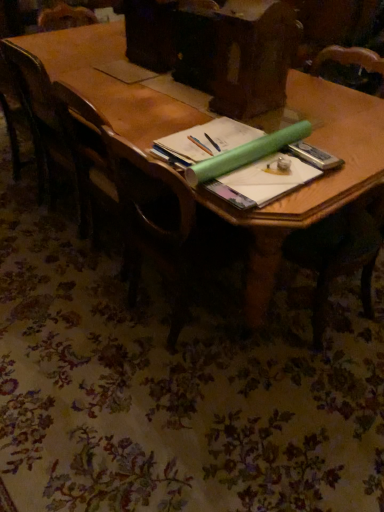
At what (x,y) coordinates should I click in order to perform the action: click on wooden chair at left, positioned as the 2th chair in front-to-back order. Please return your answer as a coordinate pair (x, y). The height and width of the screenshot is (512, 384). Looking at the image, I should click on (x=43, y=123).

What do you see at coordinates (312, 183) in the screenshot?
I see `wooden table at center` at bounding box center [312, 183].

Where is `wooden chair at center, which appears as the first chair when viewed from the front`? The image size is (384, 512). wooden chair at center, which appears as the first chair when viewed from the front is located at coordinates [x=163, y=226].

At what (x,y) coordinates should I click in order to perform the action: click on wooden chair at left, the 2th chair from the right. Please return your answer as a coordinate pair (x, y). This screenshot has height=512, width=384. Looking at the image, I should click on (43, 123).

Which object is closer to the camera taking this photo, wooden table at center or wooden chair at left, the 2th chair from the right?

wooden table at center is closer to the camera.

Are wooden table at center and wooden chair at left, positioned as the 2th chair in front-to-back order, far apart?

No, wooden table at center is in close proximity to wooden chair at left, positioned as the 2th chair in front-to-back order.

Is wooden table at center positioned with its back to wooden chair at left, the first chair in the back-to-front sequence?

wooden table at center does not have its back to wooden chair at left, the first chair in the back-to-front sequence.

Considering the sizes of wooden table at center and wooden chair at left, the 2th chair from the right, in the image, is wooden table at center taller or shorter than wooden chair at left, the 2th chair from the right,?

Considering their sizes, wooden table at center has less height than wooden chair at left, the 2th chair from the right.

From a real-world perspective, between wooden chair at left, the 2th chair from the right, and wooden table at center, who is vertically higher?

In real-world perspective, wooden chair at left, the 2th chair from the right, is above.

Is wooden chair at left, the 2th chair from the right, next to wooden table at center and touching it?

No, wooden chair at left, the 2th chair from the right, is not next to wooden table at center.

Considering the relative sizes of wooden chair at left, positioned as the 2th chair in front-to-back order, and wooden table at center in the image provided, is wooden chair at left, positioned as the 2th chair in front-to-back order, bigger than wooden table at center?

Actually, wooden chair at left, positioned as the 2th chair in front-to-back order, might be smaller than wooden table at center.

Consider the image. How different are the orientations of wooden chair at left, positioned as the first chair in left-to-right order, and wooden chair at center, the 1th chair viewed from the right, in degrees?

They differ by 1.57 degrees in their facing directions.

Considering the points (35, 58) and (124, 267), which point is behind, point (35, 58) or point (124, 267)?

The point (124, 267) is farther from the camera.

Could wooden chair at center, the 1th chair viewed from the right, be considered to be inside wooden chair at left, positioned as the 2th chair in front-to-back order?

Actually, wooden chair at center, the 1th chair viewed from the right, is outside wooden chair at left, positioned as the 2th chair in front-to-back order.

Could you tell me if wooden chair at left, the first chair in the back-to-front sequence, is facing wooden chair at center, which appears as the first chair when viewed from the front?

No, wooden chair at left, the first chair in the back-to-front sequence, is not oriented towards wooden chair at center, which appears as the first chair when viewed from the front.

Is wooden chair at center, the 1th chair viewed from the right, positioned beyond the bounds of wooden chair at left, positioned as the first chair in left-to-right order?

Yes, wooden chair at center, the 1th chair viewed from the right, is located beyond the bounds of wooden chair at left, positioned as the first chair in left-to-right order.

Is point (132, 295) positioned in front of point (37, 62)?

No, it is not.

The image size is (384, 512). In order to click on chair that appears on the right of wooden chair at left, positioned as the first chair in left-to-right order in this screenshot , I will do `click(163, 226)`.

From the image's perspective, is wooden table at center located above or below wooden chair at center, which is the second chair in left-to-right order?

wooden table at center is situated higher than wooden chair at center, which is the second chair in left-to-right order, in the image.

Relative to wooden chair at center, which is the second chair in left-to-right order, is wooden table at center in front or behind?

wooden table at center is positioned closer to the viewer than wooden chair at center, which is the second chair in left-to-right order.

You are a GUI agent. You are given a task and a screenshot of the screen. Output one action in this format:
    pyautogui.click(x=<x>, y=<y>)
    Task: Click on the table in front of the wooden chair at center, the 1th chair viewed from the right
    Image resolution: width=384 pixels, height=512 pixels.
    Given the screenshot: What is the action you would take?
    pyautogui.click(x=312, y=183)

In terms of height, does wooden table at center look taller or shorter compared to wooden chair at center, the 1th chair viewed from the right?

wooden table at center is shorter than wooden chair at center, the 1th chair viewed from the right.

From a real-world perspective, is wooden chair at center, which appears as the second chair when viewed from the back, over wooden table at center?

Yes, from a real-world perspective, wooden chair at center, which appears as the second chair when viewed from the back, is above wooden table at center.

From the image's perspective, is wooden chair at center, which is the second chair in left-to-right order, above or below wooden table at center?

From the image's perspective, wooden chair at center, which is the second chair in left-to-right order, appears below wooden table at center.

Considering the relative positions of wooden chair at center, which appears as the second chair when viewed from the back, and wooden table at center in the image provided, is wooden chair at center, which appears as the second chair when viewed from the back, to the right of wooden table at center from the viewer's perspective?

Yes, wooden chair at center, which appears as the second chair when viewed from the back, is to the right of wooden table at center.

The image size is (384, 512). I want to click on chair above the wooden table at center (from the image's perspective), so click(43, 123).

In the image, there is a wooden chair at left, the first chair in the back-to-front sequence. Find the location of `table below it (from a real-world perspective)`. table below it (from a real-world perspective) is located at coordinates (312, 183).

When comparing their distances from wooden chair at left, positioned as the 2th chair in front-to-back order, does wooden table at center or wooden chair at center, which is the second chair in left-to-right order, seem further?

wooden chair at center, which is the second chair in left-to-right order, is positioned further to the anchor wooden chair at left, positioned as the 2th chair in front-to-back order.

Based on their spatial positions, is wooden chair at center, which appears as the first chair when viewed from the front, or wooden chair at left, the 2th chair from the right, closer to wooden table at center?

wooden chair at left, the 2th chair from the right.

When comparing their distances from wooden chair at left, the first chair in the back-to-front sequence, does wooden chair at center, which appears as the first chair when viewed from the front, or wooden table at center seem closer?

wooden table at center.

From the image, which object appears to be nearer to wooden chair at center, the 1th chair viewed from the right, wooden chair at left, positioned as the 2th chair in front-to-back order, or wooden table at center?

Among the two, wooden table at center is located nearer to wooden chair at center, the 1th chair viewed from the right.

Based on their spatial positions, is wooden chair at left, positioned as the first chair in left-to-right order, or wooden chair at center, which appears as the second chair when viewed from the back, closer to wooden table at center?

The object closer to wooden table at center is wooden chair at left, positioned as the first chair in left-to-right order.

From the image, which object appears to be farther from wooden chair at center, which is the second chair in left-to-right order, wooden table at center or wooden chair at left, positioned as the 2th chair in front-to-back order?

Among the two, wooden chair at left, positioned as the 2th chair in front-to-back order, is located further to wooden chair at center, which is the second chair in left-to-right order.

You are a GUI agent. You are given a task and a screenshot of the screen. Output one action in this format:
    pyautogui.click(x=<x>, y=<y>)
    Task: Click on the table between wooden chair at left, positioned as the first chair in left-to-right order, and wooden chair at center, which appears as the second chair when viewed from the back
    Image resolution: width=384 pixels, height=512 pixels.
    Given the screenshot: What is the action you would take?
    pyautogui.click(x=312, y=183)